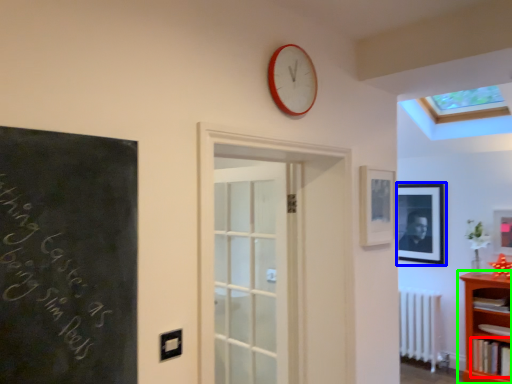
Question: Which object is positioned closest to book (highlighted by a red box)? Select from picture frame (highlighted by a blue box) and shelf (highlighted by a green box).

Choices:
 (A) picture frame
 (B) shelf

Answer: (B)